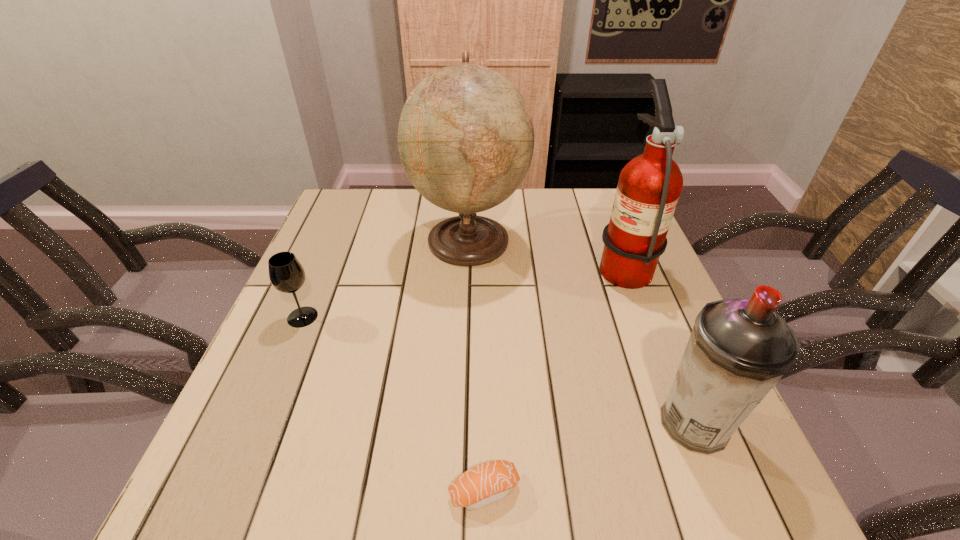
In the image, there is a desktop. Identify the location of vacant space at the far edge. This screenshot has width=960, height=540. (551, 190).

Locate an element on the screen. The height and width of the screenshot is (540, 960). vacant space at the left edge of the desktop is located at coordinates (268, 378).

Find the location of a particular element. This screenshot has height=540, width=960. vacant space at the right edge of the desktop is located at coordinates (685, 339).

In the image, there is a desktop. Identify the location of blank space at the far left corner. (339, 193).

This screenshot has width=960, height=540. I want to click on vacant region at the near left corner of the desktop, so click(190, 510).

Where is `vacant space that is in between the globe and the nearest object`? This screenshot has width=960, height=540. vacant space that is in between the globe and the nearest object is located at coordinates (x=476, y=366).

Locate an element on the screen. The width and height of the screenshot is (960, 540). blank region between the third farthest object and the shortest object is located at coordinates (394, 404).

Find the location of `vacant space that is in between the fire extinguisher and the globe`. vacant space that is in between the fire extinguisher and the globe is located at coordinates (x=545, y=252).

Image resolution: width=960 pixels, height=540 pixels. I want to click on free space between the shortest object and the fire extinguisher, so click(554, 377).

This screenshot has height=540, width=960. I want to click on free spot between the nearest object and the globe, so click(x=476, y=366).